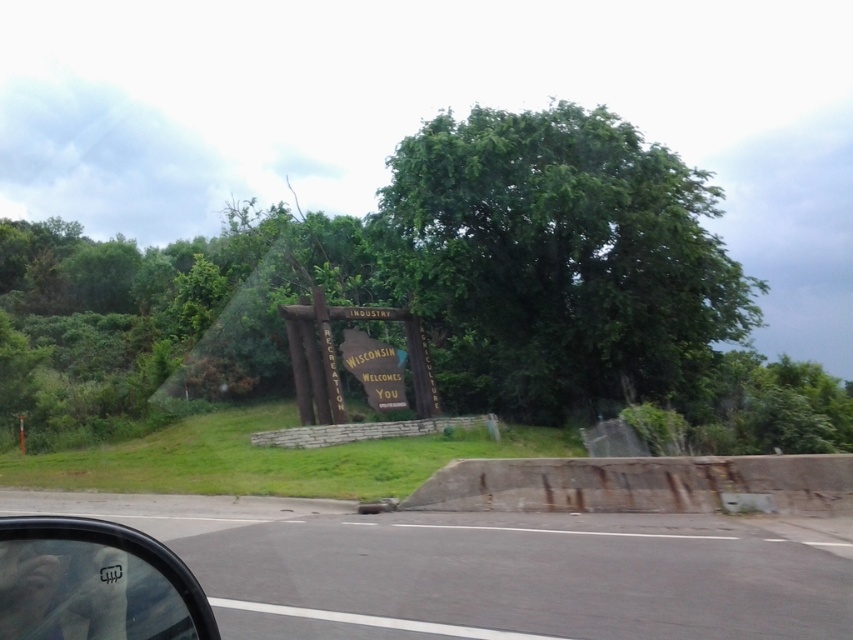
Question: Does green leafy tree at center appear under gray asphalt highway at center?

Choices:
 (A) yes
 (B) no

Answer: (B)

Question: Among these objects, which one is nearest to the camera?

Choices:
 (A) gray asphalt highway at center
 (B) yellow paper sign at center
 (C) green leafy tree at center

Answer: (A)

Question: Among these points, which one is nearest to the camera?

Choices:
 (A) (357, 360)
 (B) (844, 579)

Answer: (B)

Question: In this image, where is green leafy tree at center located relative to yellow paper sign at center?

Choices:
 (A) below
 (B) above

Answer: (B)

Question: Which is farther from the gray asphalt highway at center?

Choices:
 (A) yellow paper sign at center
 (B) transparent plastic car window at lower left

Answer: (A)

Question: Does green leafy tree at center have a greater width compared to yellow paper sign at center?

Choices:
 (A) no
 (B) yes

Answer: (B)